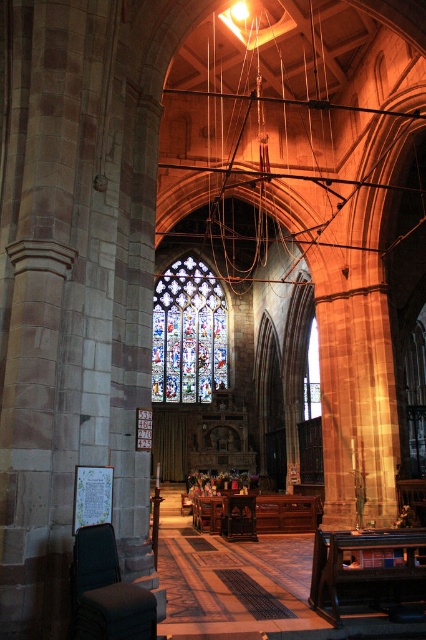
You are an architect visiting the cathedral and want to ensure the structural integrity of the stained glass window at center. Since the matte black chair at lower left is directly beneath it, could there be a risk of the chair being damaged if the window were to fall?

The stained glass window at center is positioned over matte black chair at lower left. If the window were to fall, the chair would likely be damaged as it is directly underneath.